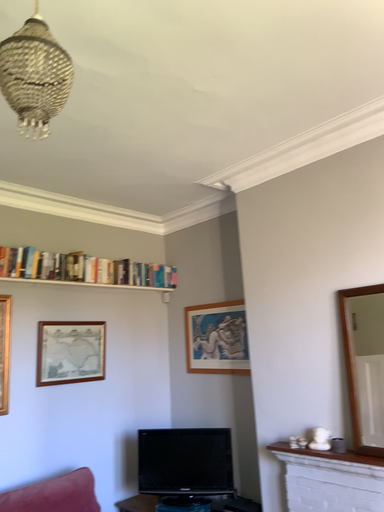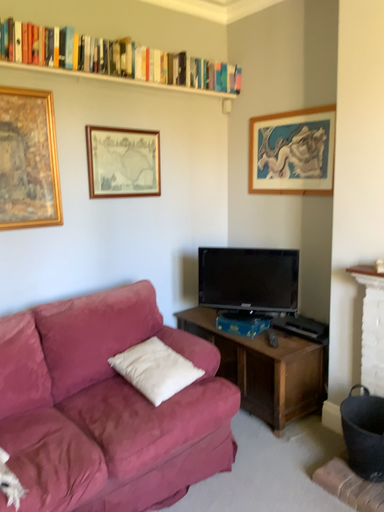
Question: Which way did the camera rotate in the video?

Choices:
 (A) rotated upward
 (B) rotated downward

Answer: (B)